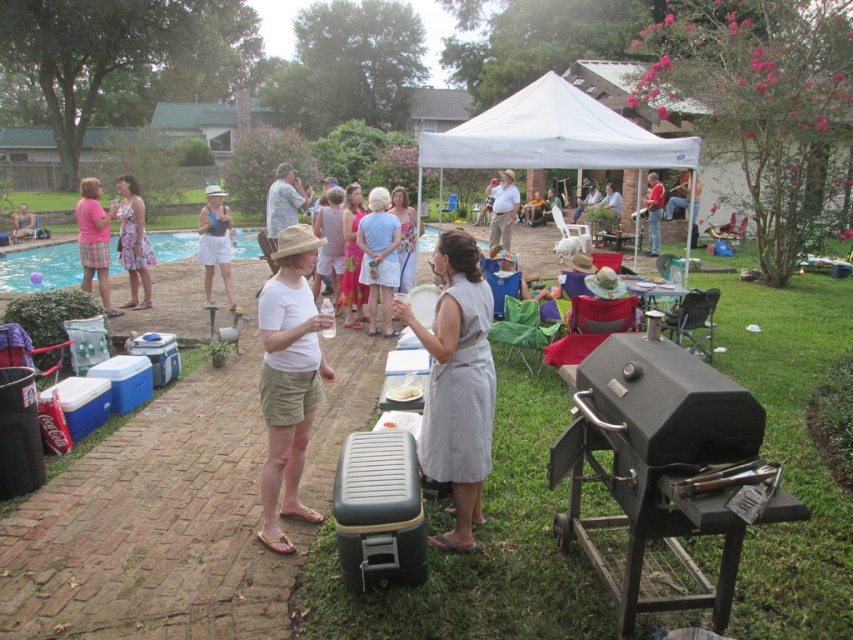
Which is in front, point (778, 486) or point (434, 163)?

Point (778, 486) is more forward.

Is black matte barbecue grill at lower right smaller than white fabric canopy at upper center?

Indeed, black matte barbecue grill at lower right has a smaller size compared to white fabric canopy at upper center.

Describe the element at coordinates (665, 472) in the screenshot. The image size is (853, 640). I see `black matte barbecue grill at lower right` at that location.

The height and width of the screenshot is (640, 853). Identify the location of black matte barbecue grill at lower right. (665, 472).

Between hawaiian shirt at center and matte black laptop at left, which one appears on the right side from the viewer's perspective?

hawaiian shirt at center

Which is more to the left, hawaiian shirt at center or matte black laptop at left?

matte black laptop at left

Which is behind, point (265, 216) or point (13, 212)?

The point (13, 212) is more distant.

You are a GUI agent. You are given a task and a screenshot of the screen. Output one action in this format:
    pyautogui.click(x=<x>, y=<y>)
    Task: Click on the hawaiian shirt at center
    The width and height of the screenshot is (853, 640).
    Given the screenshot: What is the action you would take?
    pyautogui.click(x=283, y=200)

Can you confirm if gray cotton dress at center is thinner than floral dress at center?

Incorrect, gray cotton dress at center's width is not less than floral dress at center's.

Which of these two, gray cotton dress at center or floral dress at center, stands shorter?

Standing shorter between the two is floral dress at center.

The image size is (853, 640). Describe the element at coordinates (457, 385) in the screenshot. I see `gray cotton dress at center` at that location.

Locate an element on the screen. gray cotton dress at center is located at coordinates (457, 385).